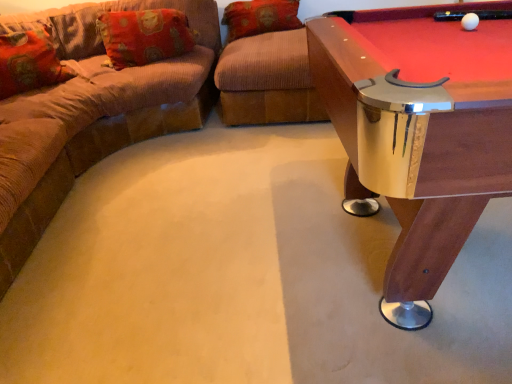
Measure the distance between orange fabric pillow at upper left, acting as the second pillow starting from the left, and camera.

They are 8.87 feet apart.

At what (x,y) coordinates should I click in order to perform the action: click on orange fabric pillow at upper left, which is the 2th pillow in right-to-left order. Please return your answer as a coordinate pair (x, y). The width and height of the screenshot is (512, 384). Looking at the image, I should click on (144, 36).

This screenshot has width=512, height=384. Describe the element at coordinates (29, 62) in the screenshot. I see `floral fabric pillow at left, positioned as the third pillow in right-to-left order` at that location.

Where is `wooden pool table at right`? The image size is (512, 384). wooden pool table at right is located at coordinates (418, 135).

At what (x,y) coordinates should I click in order to perform the action: click on orange fabric pillow at upper left, which is the 2th pillow in right-to-left order. Please return your answer as a coordinate pair (x, y). The width and height of the screenshot is (512, 384). Looking at the image, I should click on (144, 36).

Who is taller, white glossy ball at upper right or wooden pool table at right?

With more height is wooden pool table at right.

Is point (472, 17) farther from viewer compared to point (450, 45)?

Yes, it is behind point (450, 45).

Are white glossy ball at upper right and wooden pool table at right making contact?

They are not placed beside each other.

Identify the location of table below the white glossy ball at upper right (from the image's perspective). (418, 135).

Could orange corduroy pillow at upper center, the 1th pillow when ordered from right to left, be considered to be inside floral fabric pillow at left, which appears as the 1th pillow when viewed from the left?

Definitely not — orange corduroy pillow at upper center, the 1th pillow when ordered from right to left, is not inside floral fabric pillow at left, which appears as the 1th pillow when viewed from the left.

Is floral fabric pillow at left, which appears as the 1th pillow when viewed from the left, aimed at orange corduroy pillow at upper center, the 1th pillow when ordered from right to left?

No, floral fabric pillow at left, which appears as the 1th pillow when viewed from the left, does not turn towards orange corduroy pillow at upper center, the 1th pillow when ordered from right to left.

From a real-world perspective, is floral fabric pillow at left, which appears as the 1th pillow when viewed from the left, positioned under orange corduroy pillow at upper center, the 1th pillow when ordered from right to left, based on gravity?

No, from a real-world perspective, floral fabric pillow at left, which appears as the 1th pillow when viewed from the left, is not beneath orange corduroy pillow at upper center, the 1th pillow when ordered from right to left.

Does white glossy ball at upper right have a larger size compared to brown corduroy couch at left?

Actually, white glossy ball at upper right might be smaller than brown corduroy couch at left.

Is white glossy ball at upper right not inside brown corduroy couch at left?

white glossy ball at upper right lies outside brown corduroy couch at left's area.

Would you consider white glossy ball at upper right to be distant from brown corduroy couch at left?

Yes.

Is white glossy ball at upper right turned away from brown corduroy couch at left?

That's not correct — white glossy ball at upper right is not looking away from brown corduroy couch at left.

Considering the positions of objects orange corduroy pillow at upper center, positioned as the 3th pillow in left-to-right order, and floral fabric pillow at left, positioned as the third pillow in right-to-left order, in the image provided, who is in front, orange corduroy pillow at upper center, positioned as the 3th pillow in left-to-right order, or floral fabric pillow at left, positioned as the third pillow in right-to-left order,?

floral fabric pillow at left, positioned as the third pillow in right-to-left order, is closer to the camera.

From the floral fabric pillow at left, which appears as the 1th pillow when viewed from the left, count 2nd pillow to the right and point to it. Please provide its 2D coordinates.

[(260, 17)]

Between orange corduroy pillow at upper center, the 1th pillow when ordered from right to left, and floral fabric pillow at left, positioned as the third pillow in right-to-left order, which one has more height?

Standing taller between the two is floral fabric pillow at left, positioned as the third pillow in right-to-left order.

Is brown corduroy couch at left spatially inside wooden pool table at right, or outside of it?

brown corduroy couch at left exists outside the volume of wooden pool table at right.

Could you tell me if brown corduroy couch at left is turned towards wooden pool table at right?

Yes, brown corduroy couch at left is turned towards wooden pool table at right.

Is brown corduroy couch at left further to the viewer compared to wooden pool table at right?

No, brown corduroy couch at left is closer to the viewer.

Can you tell me how much brown corduroy couch at left and wooden pool table at right differ in facing direction?

The facing directions of brown corduroy couch at left and wooden pool table at right are 90.6 degrees apart.

Can you tell me how much orange fabric pillow at upper left, acting as the second pillow starting from the left, and brown corduroy couch at left differ in facing direction?

There is a 73.3-degree angle between the facing directions of orange fabric pillow at upper left, acting as the second pillow starting from the left, and brown corduroy couch at left.

Identify the location of studio couch below the orange fabric pillow at upper left, acting as the second pillow starting from the left (from the image's perspective). (106, 110).

Which object is positioned more to the right, orange fabric pillow at upper left, which is the 2th pillow in right-to-left order, or brown corduroy couch at left?

orange fabric pillow at upper left, which is the 2th pillow in right-to-left order.

From a real-world perspective, does floral fabric pillow at left, which appears as the 1th pillow when viewed from the left, stand above orange fabric pillow at upper left, which is the 2th pillow in right-to-left order?

Yes.

You are a GUI agent. You are given a task and a screenshot of the screen. Output one action in this format:
    pyautogui.click(x=<x>, y=<y>)
    Task: Click on the pillow that appears on the left of orange fabric pillow at upper left, acting as the second pillow starting from the left
    This screenshot has width=512, height=384.
    Given the screenshot: What is the action you would take?
    pyautogui.click(x=29, y=62)

Consider the image. Measure the distance from floral fabric pillow at left, which appears as the 1th pillow when viewed from the left, to orange fabric pillow at upper left, which is the 2th pillow in right-to-left order.

They are 20.24 inches apart.

Considering the sizes of objects floral fabric pillow at left, which appears as the 1th pillow when viewed from the left, and orange fabric pillow at upper left, acting as the second pillow starting from the left, in the image provided, who is shorter, floral fabric pillow at left, which appears as the 1th pillow when viewed from the left, or orange fabric pillow at upper left, acting as the second pillow starting from the left,?

orange fabric pillow at upper left, acting as the second pillow starting from the left, is shorter.

Where is `table located in front of the white glossy ball at upper right`? This screenshot has width=512, height=384. table located in front of the white glossy ball at upper right is located at coordinates (418, 135).

Where is `pillow that is the 2nd one when counting upward from the floral fabric pillow at left, which appears as the 1th pillow when viewed from the left (from the image's perspective)`? This screenshot has width=512, height=384. pillow that is the 2nd one when counting upward from the floral fabric pillow at left, which appears as the 1th pillow when viewed from the left (from the image's perspective) is located at coordinates (260, 17).

Which object lies further to the anchor point white glossy ball at upper right, brown corduroy couch at left or floral fabric pillow at left, which appears as the 1th pillow when viewed from the left?

Among the two, floral fabric pillow at left, which appears as the 1th pillow when viewed from the left, is located further to white glossy ball at upper right.

Looking at the image, which one is located closer to floral fabric pillow at left, positioned as the third pillow in right-to-left order, orange corduroy pillow at upper center, the 1th pillow when ordered from right to left, or brown corduroy ottoman at center?

brown corduroy ottoman at center is closer to floral fabric pillow at left, positioned as the third pillow in right-to-left order.

When comparing their distances from white glossy ball at upper right, does orange fabric pillow at upper left, which is the 2th pillow in right-to-left order, or wooden pool table at right seem further?

The object further to white glossy ball at upper right is orange fabric pillow at upper left, which is the 2th pillow in right-to-left order.

Based on their spatial positions, is white glossy ball at upper right or orange fabric pillow at upper left, which is the 2th pillow in right-to-left order, further from floral fabric pillow at left, positioned as the third pillow in right-to-left order?

Based on the image, white glossy ball at upper right appears to be further to floral fabric pillow at left, positioned as the third pillow in right-to-left order.

Based on the photo, from the image, which object appears to be nearer to orange corduroy pillow at upper center, the 1th pillow when ordered from right to left, wooden pool table at right or brown corduroy ottoman at center?

Based on the image, brown corduroy ottoman at center appears to be nearer to orange corduroy pillow at upper center, the 1th pillow when ordered from right to left.

When comparing their distances from brown corduroy couch at left, does orange corduroy pillow at upper center, positioned as the 3th pillow in left-to-right order, or floral fabric pillow at left, which appears as the 1th pillow when viewed from the left, seem closer?

floral fabric pillow at left, which appears as the 1th pillow when viewed from the left.

Considering their positions, is floral fabric pillow at left, which appears as the 1th pillow when viewed from the left, positioned further to wooden pool table at right than orange fabric pillow at upper left, which is the 2th pillow in right-to-left order?

Among the two, floral fabric pillow at left, which appears as the 1th pillow when viewed from the left, is located further to wooden pool table at right.

Based on their spatial positions, is white glossy ball at upper right or orange corduroy pillow at upper center, positioned as the 3th pillow in left-to-right order, closer to wooden pool table at right?

white glossy ball at upper right.

In order to click on pillow located between brown corduroy couch at left and orange fabric pillow at upper left, which is the 2th pillow in right-to-left order, in the depth direction in this screenshot , I will do `click(29, 62)`.

Where is `ball between wooden pool table at right and orange fabric pillow at upper left, which is the 2th pillow in right-to-left order, along the z-axis`? ball between wooden pool table at right and orange fabric pillow at upper left, which is the 2th pillow in right-to-left order, along the z-axis is located at coordinates (470, 21).

Where is `table located between brown corduroy couch at left and brown corduroy ottoman at center in the depth direction`? The image size is (512, 384). table located between brown corduroy couch at left and brown corduroy ottoman at center in the depth direction is located at coordinates (418, 135).

Identify the location of ball between brown corduroy couch at left and orange corduroy pillow at upper center, positioned as the 3th pillow in left-to-right order, in the front-back direction. The image size is (512, 384). (470, 21).